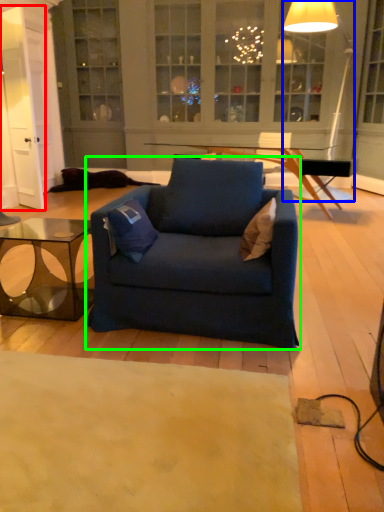
Question: Which object is the closest to the glass door (highlighted by a red box)? Choose among these: lamp (highlighted by a blue box) or chair (highlighted by a green box).

Choices:
 (A) lamp
 (B) chair

Answer: (B)